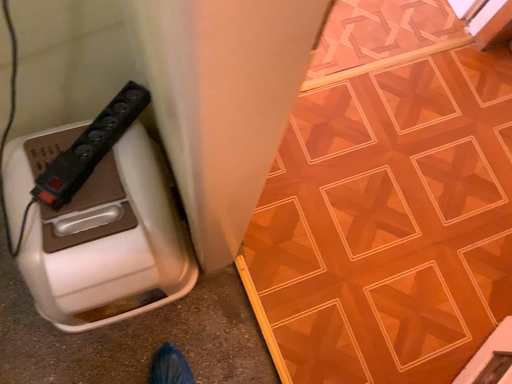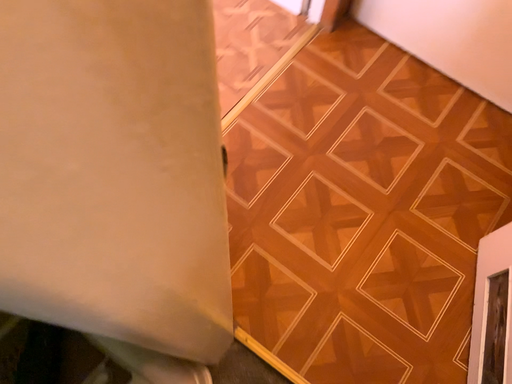
Question: How did the camera likely rotate when shooting the video?

Choices:
 (A) rotated left
 (B) rotated right

Answer: (B)